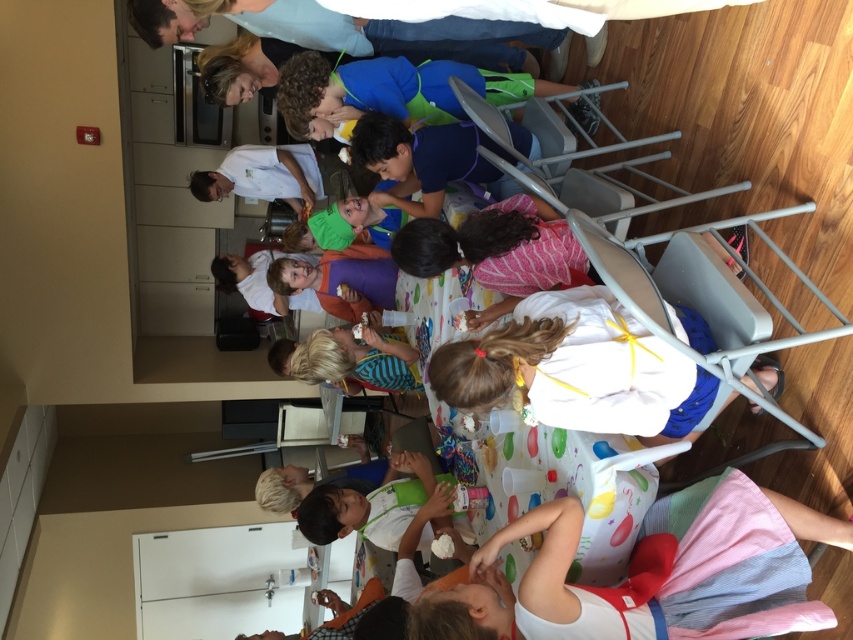
What do you see at coordinates (387, 92) in the screenshot? I see `blue fabric shirt at upper center` at bounding box center [387, 92].

Is blue fabric shirt at upper center further to the viewer compared to blue fabric shirt at center?

Yes, it is.

Find the location of a particular element. The width and height of the screenshot is (853, 640). blue fabric shirt at upper center is located at coordinates (387, 92).

Does white fabric shirt at center have a smaller size compared to blue fabric shirt at upper center?

Yes.

What do you see at coordinates (577, 369) in the screenshot?
I see `white fabric shirt at center` at bounding box center [577, 369].

Does point (611, 433) lie behind point (386, 83)?

No, (611, 433) is in front of (386, 83).

Where is `white fabric shirt at center`? The width and height of the screenshot is (853, 640). white fabric shirt at center is located at coordinates (577, 369).

Who is taller, white cotton dress at lower right or light brown hair at center?

With more height is light brown hair at center.

Is white cotton dress at lower right wider than light brown hair at center?

Yes.

Is point (534, 616) positioned in front of point (303, 531)?

Yes, point (534, 616) is closer to viewer.

Find the location of a particular element. The height and width of the screenshot is (640, 853). white cotton dress at lower right is located at coordinates (695, 572).